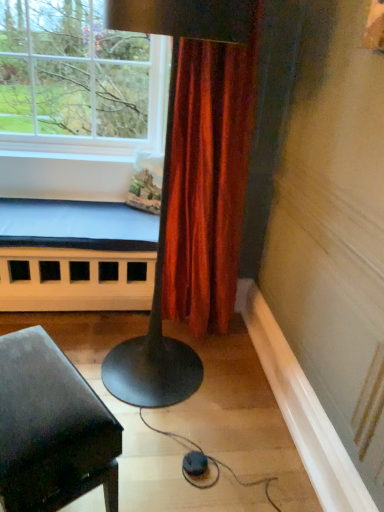
At what (x,y) coordinates should I click in order to perform the action: click on vacant space situated above white painted wood bed frame at lower left (from a real-world perspective). Please return your answer as a coordinate pair (x, y). The image size is (384, 512). Looking at the image, I should click on (75, 218).